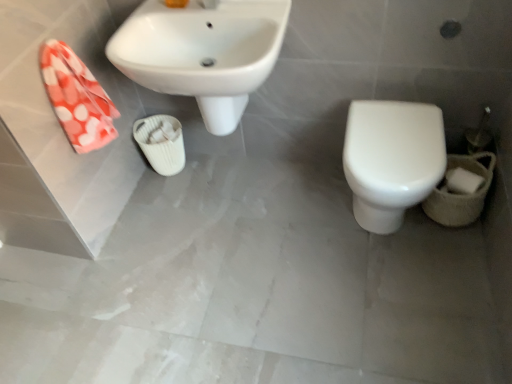
Locate an element on the screen. The height and width of the screenshot is (384, 512). vacant space that is in between white glossy toilet at lower right and white ribbed cup at center is located at coordinates (264, 190).